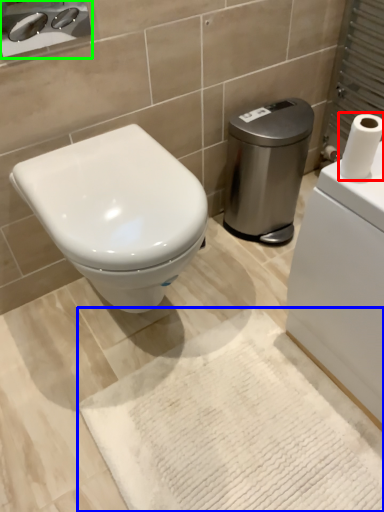
Question: Which is nearer to the toilet paper (highlighted by a red box)? bath mat (highlighted by a blue box) or sink (highlighted by a green box).

Choices:
 (A) bath mat
 (B) sink

Answer: (A)